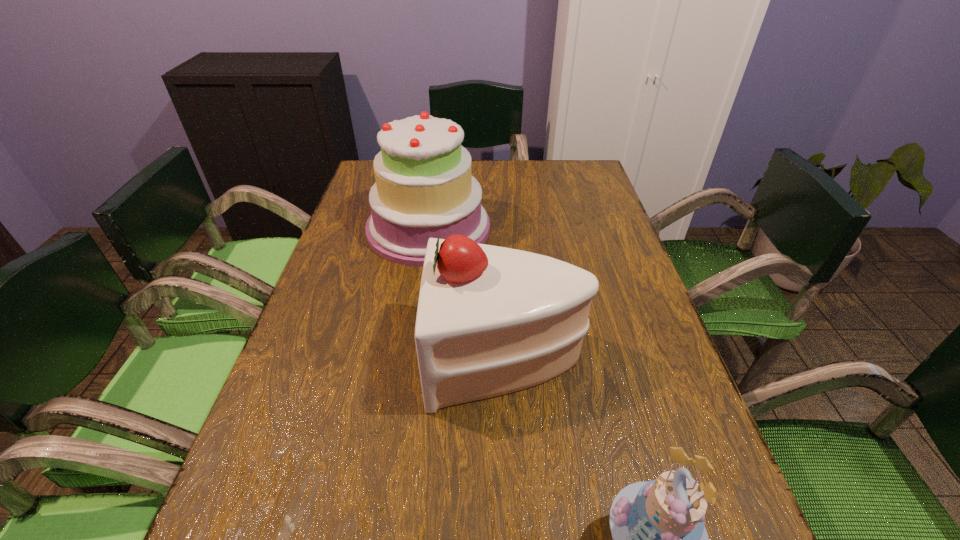
The image size is (960, 540). I want to click on the farthest cake, so click(424, 187).

This screenshot has width=960, height=540. I want to click on the second nearest object, so click(491, 320).

Where is `free space located on the back of the farthest object`? Image resolution: width=960 pixels, height=540 pixels. free space located on the back of the farthest object is located at coordinates (435, 185).

Identify the location of vacant space located on the back of the second nearest object. This screenshot has height=540, width=960. (499, 244).

Locate an element on the screen. Image resolution: width=960 pixels, height=540 pixels. object present at the left edge is located at coordinates (424, 187).

In order to click on free space at the left edge in this screenshot , I will do `click(276, 531)`.

This screenshot has width=960, height=540. In the image, there is a desktop. Identify the location of blank space at the right edge. point(623,312).

In the image, there is a desktop. Identify the location of free space at the far right corner. (588, 184).

Select which object appears as the closest to the nearest object. Please provide its 2D coordinates. Your answer should be formatted as a tuple, i.e. [(x, y)], where the tuple contains the x and y coordinates of a point satisfying the conditions above.

[(491, 320)]

I want to click on object that stands as the second closest to the farthest cake, so click(659, 537).